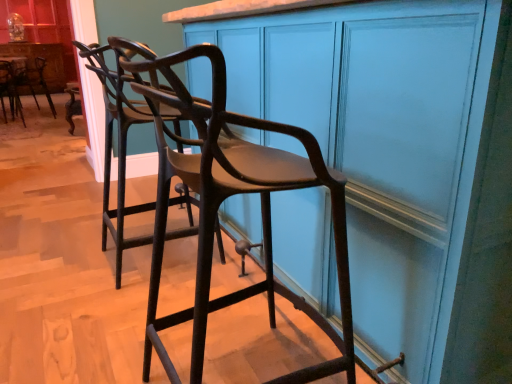
Identify the location of matte black bar stool at left, the 2th chair viewed from the front. (10, 89).

At what (x,y) coordinates should I click in order to perform the action: click on matte black bar stool at left, acting as the first chair starting from the back. Please return your answer as a coordinate pair (x, y). Looking at the image, I should click on (27, 80).

The image size is (512, 384). Describe the element at coordinates (226, 198) in the screenshot. I see `matte brown wood chair at center, which ranks as the 3th chair in left-to-right order` at that location.

What do you see at coordinates (397, 158) in the screenshot?
I see `matte wood cabinet at center, which appears as the 1th cabinetry when viewed from the right` at bounding box center [397, 158].

Where is `matte black bar stool at left, acting as the 2th chair starting from the right`? matte black bar stool at left, acting as the 2th chair starting from the right is located at coordinates (10, 89).

Is matte brown wood chair at center, the 3th chair when ordered from back to front, outside of matte blue cabinet at upper left, the first cabinetry when ordered from left to right?

matte brown wood chair at center, the 3th chair when ordered from back to front, is positioned outside matte blue cabinet at upper left, the first cabinetry when ordered from left to right.

Between point (150, 91) and point (40, 90), which one is positioned in front?

The point (150, 91) is in front.

How many degrees apart are the facing directions of matte brown wood chair at center, marked as the first chair in a bottom-to-top arrangement, and matte blue cabinet at upper left, which is the 2th cabinetry from front to back?

The facing directions of matte brown wood chair at center, marked as the first chair in a bottom-to-top arrangement, and matte blue cabinet at upper left, which is the 2th cabinetry from front to back, are 89 degrees apart.

Are matte brown wood chair at center, which appears as the 1th chair when viewed from the right, and matte blue cabinet at upper left, the first cabinetry when ordered from left to right, located far from each other?

Yes.

Can matte black bar stool at left, which appears as the 2th chair when viewed from the back, be found inside matte blue cabinet at upper left, the 1th cabinetry when ordered from back to front?

No, matte black bar stool at left, which appears as the 2th chair when viewed from the back, is not a part of matte blue cabinet at upper left, the 1th cabinetry when ordered from back to front.

In the scene shown: Considering the sizes of matte blue cabinet at upper left, positioned as the 2th cabinetry in right-to-left order, and matte black bar stool at left, acting as the 2th chair starting from the right, in the image, is matte blue cabinet at upper left, positioned as the 2th cabinetry in right-to-left order, taller or shorter than matte black bar stool at left, acting as the 2th chair starting from the right,?

Clearly, matte blue cabinet at upper left, positioned as the 2th cabinetry in right-to-left order, is taller compared to matte black bar stool at left, acting as the 2th chair starting from the right.

Could you measure the distance between matte blue cabinet at upper left, the 1th cabinetry when ordered from back to front, and matte black bar stool at left, which is counted as the 2th chair, starting from the top?

matte blue cabinet at upper left, the 1th cabinetry when ordered from back to front, and matte black bar stool at left, which is counted as the 2th chair, starting from the top, are 35.04 centimeters apart.

Between matte blue cabinet at upper left, marked as the 2th cabinetry in a bottom-to-top arrangement, and matte black bar stool at left, which is counted as the 2th chair, starting from the top, which one appears on the left side from the viewer's perspective?

Positioned to the left is matte blue cabinet at upper left, marked as the 2th cabinetry in a bottom-to-top arrangement.

Visually, is matte black bar stool at left, which is counted as the 2th chair, starting from the top, positioned to the left or to the right of matte wood cabinet at center, which appears as the 1th cabinetry when viewed from the right?

matte black bar stool at left, which is counted as the 2th chair, starting from the top, is to the left of matte wood cabinet at center, which appears as the 1th cabinetry when viewed from the right.

Which is closer to the camera, (x=20, y=114) or (x=278, y=54)?

Point (x=278, y=54)

Considering the sizes of objects matte black bar stool at left, the second chair viewed from the left, and matte wood cabinet at center, acting as the 1th cabinetry starting from the bottom, in the image provided, who is smaller, matte black bar stool at left, the second chair viewed from the left, or matte wood cabinet at center, acting as the 1th cabinetry starting from the bottom,?

matte black bar stool at left, the second chair viewed from the left.

Which object is closer to the camera, matte black bar stool at left, which appears as the 2th chair when viewed from the back, or matte wood cabinet at center, which appears as the 1th cabinetry when viewed from the right?

matte wood cabinet at center, which appears as the 1th cabinetry when viewed from the right, is closer to the camera.

From the image's perspective, is matte black bar stool at left, acting as the first chair starting from the back, above matte blue cabinet at upper left, the 1th cabinetry when ordered from back to front?

No.

Is matte black bar stool at left, which ranks as the 3th chair in front-to-back order, inside or outside of matte blue cabinet at upper left, the 1th cabinetry positioned from the top?

matte black bar stool at left, which ranks as the 3th chair in front-to-back order, is not inside matte blue cabinet at upper left, the 1th cabinetry positioned from the top, it's outside.

Are matte black bar stool at left, which is the 1th chair from top to bottom, and matte blue cabinet at upper left, the 1th cabinetry positioned from the top, beside each other?

No, matte black bar stool at left, which is the 1th chair from top to bottom, is not in contact with matte blue cabinet at upper left, the 1th cabinetry positioned from the top.

Which of these two, matte black bar stool at left, acting as the first chair starting from the back, or matte blue cabinet at upper left, the 1th cabinetry when ordered from back to front, is thinner?

matte blue cabinet at upper left, the 1th cabinetry when ordered from back to front.

In the scene shown: Is matte black bar stool at left, the 2th chair viewed from the front, oriented away from matte blue cabinet at upper left, marked as the 2th cabinetry in a bottom-to-top arrangement?

No.

Is matte black bar stool at left, the second chair viewed from the left, spatially inside matte blue cabinet at upper left, which is the 2th cabinetry from front to back, or outside of it?

matte black bar stool at left, the second chair viewed from the left, is located beyond the bounds of matte blue cabinet at upper left, which is the 2th cabinetry from front to back.

Can you confirm if matte black bar stool at left, acting as the 2th chair starting from the right, is thinner than matte blue cabinet at upper left, the 1th cabinetry when ordered from back to front?

No.

Can you confirm if matte black bar stool at left, which appears as the 2th chair when viewed from the back, is smaller than matte blue cabinet at upper left, which is the 2th cabinetry from front to back?

Correct, matte black bar stool at left, which appears as the 2th chair when viewed from the back, occupies less space than matte blue cabinet at upper left, which is the 2th cabinetry from front to back.

Who is smaller, matte black bar stool at left, the 1th chair when ordered from left to right, or matte wood cabinet at center, which is the 1th cabinetry in front-to-back order?

Smaller between the two is matte black bar stool at left, the 1th chair when ordered from left to right.

Based on the photo, is matte black bar stool at left, which is the 1th chair from top to bottom, completely or partially outside of matte wood cabinet at center, which appears as the 1th cabinetry when viewed from the right?

Absolutely, matte black bar stool at left, which is the 1th chair from top to bottom, is external to matte wood cabinet at center, which appears as the 1th cabinetry when viewed from the right.

Which object is thinner, matte black bar stool at left, acting as the first chair starting from the back, or matte wood cabinet at center, the second cabinetry from the left?

matte black bar stool at left, acting as the first chair starting from the back, is thinner.

Identify the location of the 3rd chair to the left when counting from the matte wood cabinet at center, acting as the 1th cabinetry starting from the bottom. (27, 80).

Which is behind, matte black bar stool at left, the second chair viewed from the left, or matte black bar stool at left, acting as the first chair starting from the back?

matte black bar stool at left, acting as the first chair starting from the back, is more distant.

In the scene shown: Between matte black bar stool at left, the 2th chair viewed from the front, and matte black bar stool at left, which is the 1th chair from top to bottom, which one appears on the left side from the viewer's perspective?

From the viewer's perspective, matte black bar stool at left, which is the 1th chair from top to bottom, appears more on the left side.

Could matte black bar stool at left, the third chair in the bottom-to-top sequence, be considered to be inside matte black bar stool at left, which appears as the 2th chair when viewed from the back?

Actually, matte black bar stool at left, the third chair in the bottom-to-top sequence, is outside matte black bar stool at left, which appears as the 2th chair when viewed from the back.

Based on the photo, does matte black bar stool at left, which appears as the 2th chair when ordered from the bottom, have a smaller size compared to matte black bar stool at left, which is the 1th chair from top to bottom?

Yes, matte black bar stool at left, which appears as the 2th chair when ordered from the bottom, is smaller than matte black bar stool at left, which is the 1th chair from top to bottom.

Find the location of `cabinetry that appears behind the matte brown wood chair at center, marked as the third chair in a top-to-bottom arrangement`. cabinetry that appears behind the matte brown wood chair at center, marked as the third chair in a top-to-bottom arrangement is located at coordinates (41, 57).

The height and width of the screenshot is (384, 512). In order to click on chair that is the 2nd one when counting forward from the matte blue cabinet at upper left, the first cabinetry when ordered from left to right in this screenshot , I will do `click(10, 89)`.

In the scene shown: Considering their positions, is matte black bar stool at left, which ranks as the 3th chair in front-to-back order, positioned further to matte black bar stool at left, which appears as the 2th chair when ordered from the bottom, than matte blue cabinet at upper left, the first cabinetry when ordered from left to right?

The object further to matte black bar stool at left, which appears as the 2th chair when ordered from the bottom, is matte blue cabinet at upper left, the first cabinetry when ordered from left to right.

Based on their spatial positions, is matte black bar stool at left, which appears as the 2th chair when viewed from the back, or matte brown wood chair at center, marked as the third chair in a top-to-bottom arrangement, further from matte blue cabinet at upper left, the first cabinetry when ordered from left to right?

Among the two, matte brown wood chair at center, marked as the third chair in a top-to-bottom arrangement, is located further to matte blue cabinet at upper left, the first cabinetry when ordered from left to right.

Looking at the image, which one is located further to matte blue cabinet at upper left, the 1th cabinetry when ordered from back to front, matte brown wood chair at center, which appears as the 1th chair when viewed from the right, or matte black bar stool at left, the 2th chair viewed from the front?

matte brown wood chair at center, which appears as the 1th chair when viewed from the right, lies further to matte blue cabinet at upper left, the 1th cabinetry when ordered from back to front, than the other object.

Based on their spatial positions, is matte black bar stool at left, the second chair viewed from the left, or matte black bar stool at left, which is the 1th chair from top to bottom, closer to matte brown wood chair at center, which appears as the 1th chair when viewed from the right?

Among the two, matte black bar stool at left, which is the 1th chair from top to bottom, is located nearer to matte brown wood chair at center, which appears as the 1th chair when viewed from the right.

Which object lies nearer to the anchor point matte black bar stool at left, which ranks as the 3th chair in front-to-back order, matte wood cabinet at center, which appears as the 1th cabinetry when viewed from the right, or matte brown wood chair at center, the 1th chair from the front?

matte brown wood chair at center, the 1th chair from the front, is closer to matte black bar stool at left, which ranks as the 3th chair in front-to-back order.

From the image, which object appears to be nearer to matte wood cabinet at center, the second cabinetry when ordered from back to front, matte brown wood chair at center, which appears as the 1th chair when viewed from the right, or matte blue cabinet at upper left, which is the 2th cabinetry from front to back?

Based on the image, matte brown wood chair at center, which appears as the 1th chair when viewed from the right, appears to be nearer to matte wood cabinet at center, the second cabinetry when ordered from back to front.

Consider the image. Based on their spatial positions, is matte black bar stool at left, acting as the first chair starting from the back, or matte wood cabinet at center, which appears as the 1th cabinetry when viewed from the right, further from matte black bar stool at left, acting as the 2th chair starting from the right?

Among the two, matte wood cabinet at center, which appears as the 1th cabinetry when viewed from the right, is located further to matte black bar stool at left, acting as the 2th chair starting from the right.

Based on their spatial positions, is matte brown wood chair at center, the 3th chair when ordered from back to front, or matte black bar stool at left, which is the 1th chair from top to bottom, closer to matte blue cabinet at upper left, the 1th cabinetry positioned from the top?

The object closer to matte blue cabinet at upper left, the 1th cabinetry positioned from the top, is matte black bar stool at left, which is the 1th chair from top to bottom.

Where is `chair between matte brown wood chair at center, which ranks as the 3th chair in left-to-right order, and matte black bar stool at left, the 3th chair positioned from the right, along the z-axis`? The image size is (512, 384). chair between matte brown wood chair at center, which ranks as the 3th chair in left-to-right order, and matte black bar stool at left, the 3th chair positioned from the right, along the z-axis is located at coordinates (10, 89).

This screenshot has width=512, height=384. I want to click on chair positioned between matte wood cabinet at center, which appears as the 1th cabinetry when viewed from the right, and matte black bar stool at left, the 2th chair viewed from the front, from near to far, so click(226, 198).

Find the location of `chair between matte black bar stool at left, acting as the 2th chair starting from the right, and matte blue cabinet at upper left, which is the 2th cabinetry from front to back, from front to back`. chair between matte black bar stool at left, acting as the 2th chair starting from the right, and matte blue cabinet at upper left, which is the 2th cabinetry from front to back, from front to back is located at coordinates (27, 80).